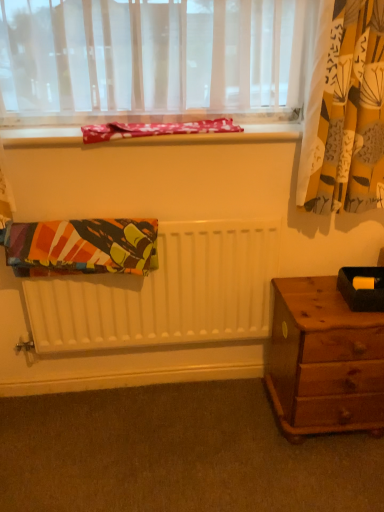
You are a GUI agent. You are given a task and a screenshot of the screen. Output one action in this format:
    pyautogui.click(x=<x>, y=<y>)
    Task: Click on the vacant area on top of white matte radiator at center (from a real-world perspective)
    
    Given the screenshot: What is the action you would take?
    pyautogui.click(x=77, y=217)